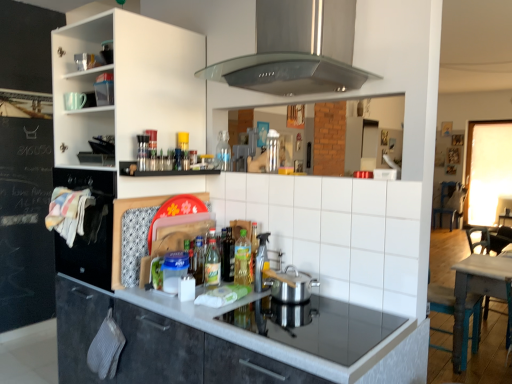
Where is `free point above metallic silver shelf at upper center (from a real-world perspective)`? The width and height of the screenshot is (512, 384). free point above metallic silver shelf at upper center (from a real-world perspective) is located at coordinates (177, 161).